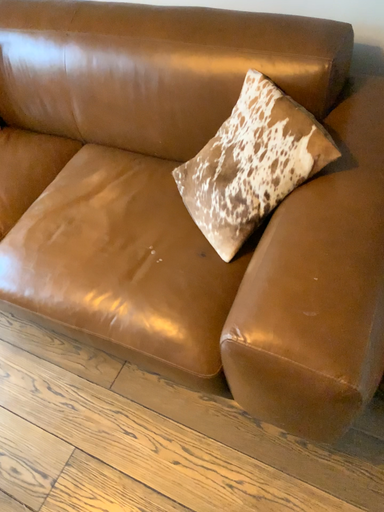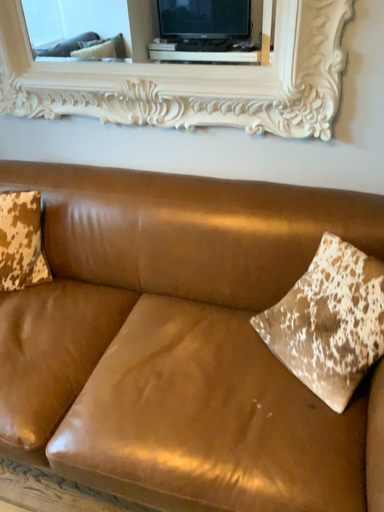
Question: How did the camera likely rotate when shooting the video?

Choices:
 (A) rotated left
 (B) rotated right

Answer: (B)